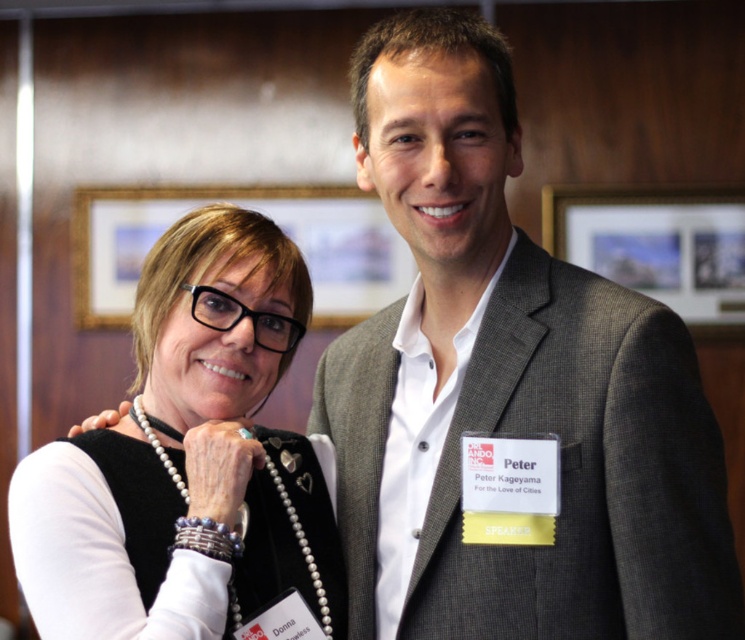
You are at a formal event and need to find the gray wool suit at center. According to the spatial description, where exactly is it positioned?

The gray wool suit at center is located at point coordinates (510, 385).

Consider the image. You are organizing a fashion show and need to display the gray wool suit at center and pearl necklace at center together. Which item should be placed on a larger display stand to match their sizes?

The gray wool suit at center has a larger size compared to pearl necklace at center, so it should be placed on a larger display stand to match their sizes.